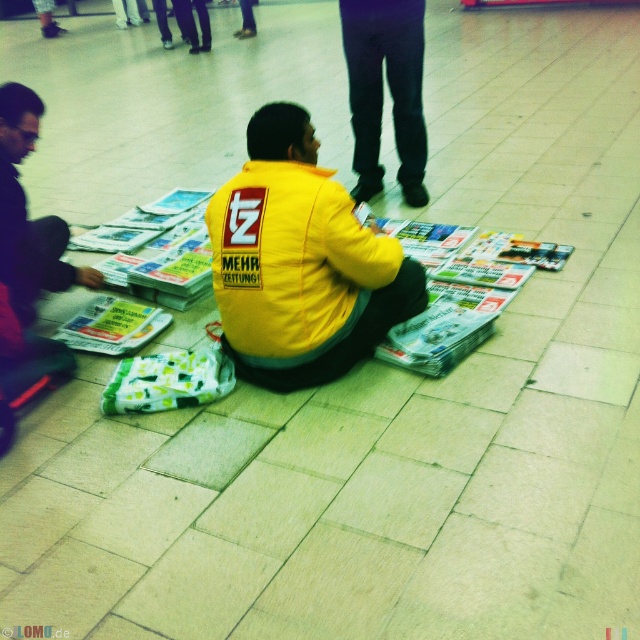
Question: Among these objects, which one is nearest to the camera?

Choices:
 (A) yellow matte jacket at center
 (B) green glossy magazine at center
 (C) matte black jacket at left
 (D) dark blue jeans at center

Answer: (A)

Question: Which point appears farthest from the camera in this image?

Choices:
 (A) (19, 250)
 (B) (396, 248)
 (C) (70, 321)
 (D) (417, 102)

Answer: (D)

Question: Does yellow matte jacket at center have a lesser width compared to dark blue jeans at center?

Choices:
 (A) no
 (B) yes

Answer: (A)

Question: Does matte black jacket at left have a smaller size compared to green glossy magazine at center?

Choices:
 (A) yes
 (B) no

Answer: (B)

Question: Which point is farther from the camera taking this photo?

Choices:
 (A) (396, 72)
 (B) (150, 324)

Answer: (A)

Question: Does dark blue jeans at center have a larger size compared to green glossy magazine at center?

Choices:
 (A) yes
 (B) no

Answer: (A)